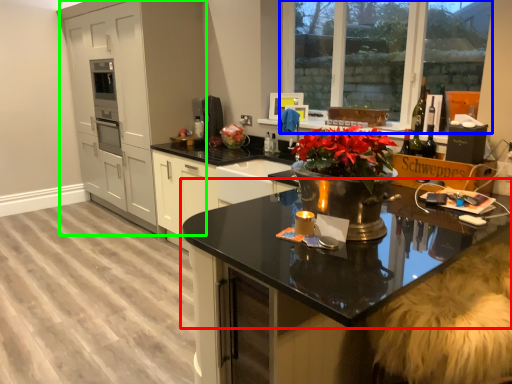
Question: Considering the real-world distances, which object is closest to countertop (highlighted by a red box)? window (highlighted by a blue box) or cabinetry (highlighted by a green box).

Choices:
 (A) window
 (B) cabinetry

Answer: (B)